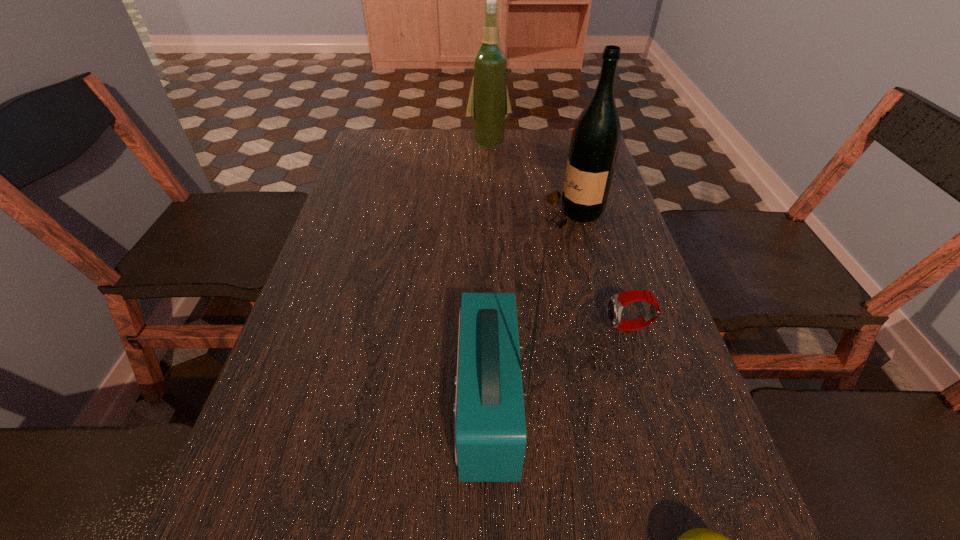
Identify the location of vacant space that's between the radio receiver and the watch. This screenshot has height=540, width=960. (559, 366).

Find the location of a particular element. The image size is (960, 540). the second closest object to the farthest object is located at coordinates (616, 303).

Point out which object is positioned as the third nearest to the watch. Please provide its 2D coordinates. Your answer should be formatted as a tuple, i.e. [(x, y)], where the tuple contains the x and y coordinates of a point satisfying the conditions above.

[(699, 539)]

The height and width of the screenshot is (540, 960). Find the location of `free location that satisfies the following two spatial constraints: 1. on the front-facing side of the farthest object; 2. on the front panel of the fourth farthest object`. free location that satisfies the following two spatial constraints: 1. on the front-facing side of the farthest object; 2. on the front panel of the fourth farthest object is located at coordinates (496, 406).